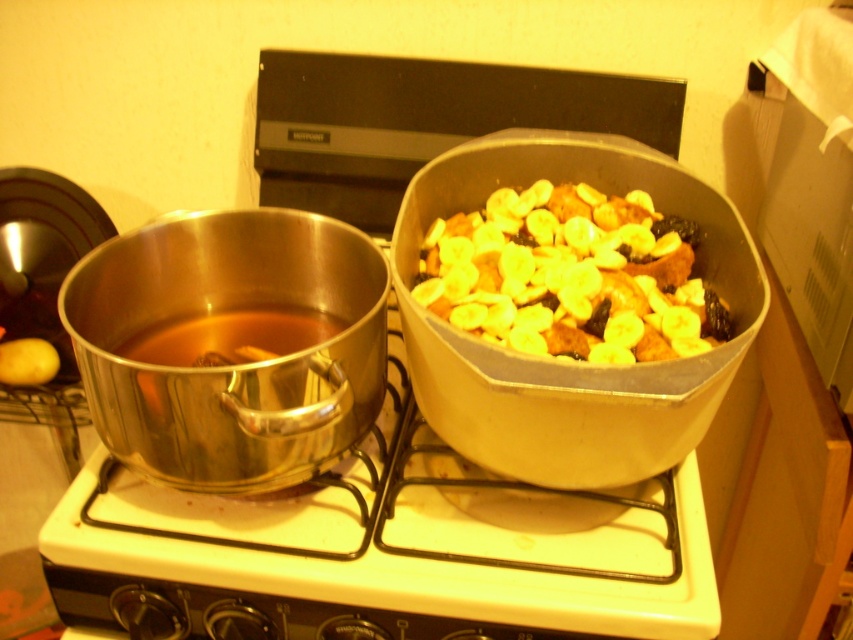
You are a chef preparing a meal and need to move the yellowish matte bananas at center to the right side of the metallic white gas stove at center. Is this possible given their current positions?

The metallic white gas stove at center is positioned on the left side of yellowish matte bananas at center. To move the yellowish matte bananas at center to the right side of the metallic white gas stove at center, you would need to shift them further to the right since they are already to the right of the stove.

You are a chef preparing a dish and need to know which item is bigger between the metallic white gas stove at center and the yellowish matte bananas at center. Can you tell me which one is larger?

The metallic white gas stove at center has a larger size compared to yellowish matte bananas at center, so the metallic white gas stove at center is bigger.